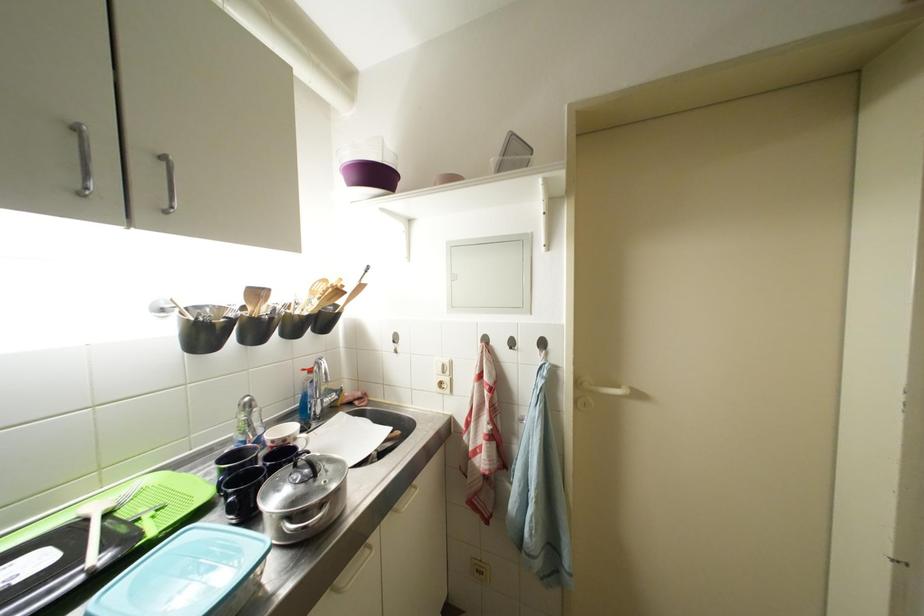
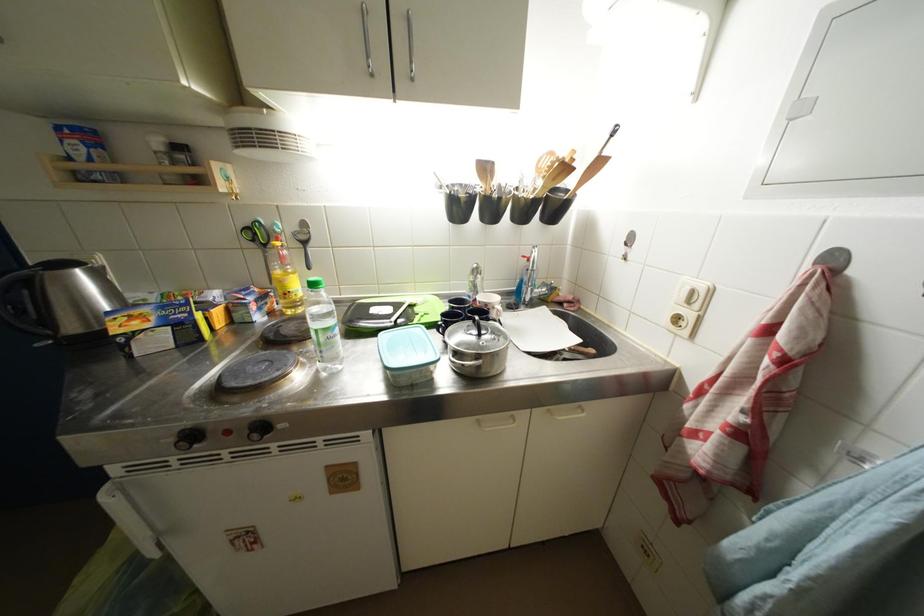
In the second image, find the point that corresponds to point (261, 453) in the first image.

(477, 307)